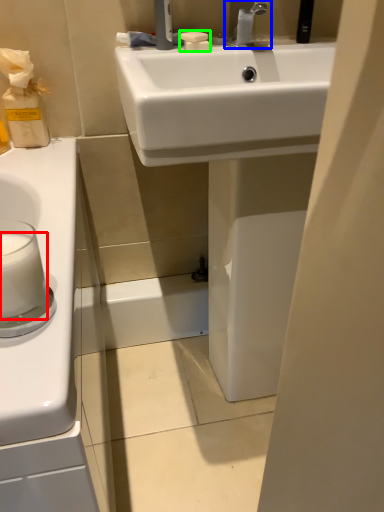
Question: Which object is the farthest from milk (highlighted by a red box)? Choose among these: tap (highlighted by a blue box) or soap (highlighted by a green box).

Choices:
 (A) tap
 (B) soap

Answer: (A)